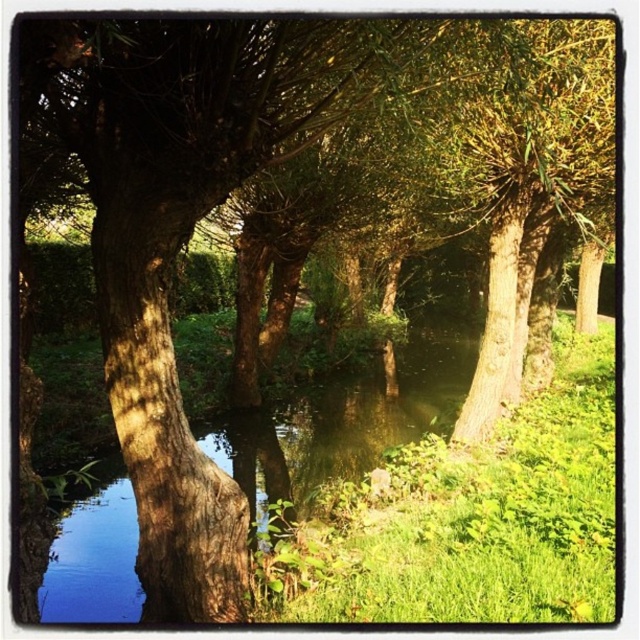
Question: Can you confirm if green leafy grass at center is thinner than blue reflective water at center?

Choices:
 (A) no
 (B) yes

Answer: (B)

Question: Which point is closer to the camera?

Choices:
 (A) blue reflective water at center
 (B) green leafy grass at center

Answer: (B)

Question: Can you confirm if green leafy grass at center is positioned to the right of blue reflective water at center?

Choices:
 (A) no
 (B) yes

Answer: (B)

Question: Does green leafy grass at center have a larger size compared to blue reflective water at center?

Choices:
 (A) yes
 (B) no

Answer: (B)